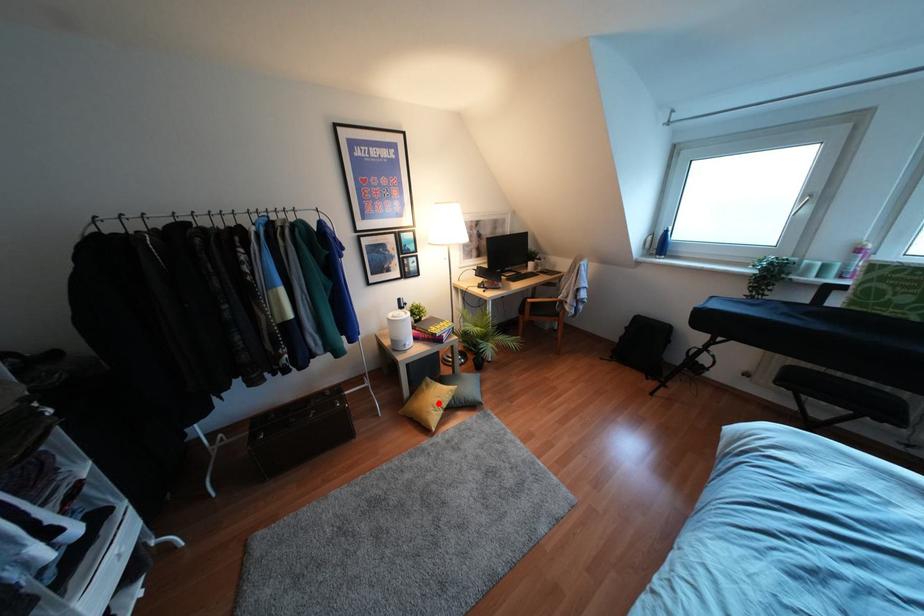
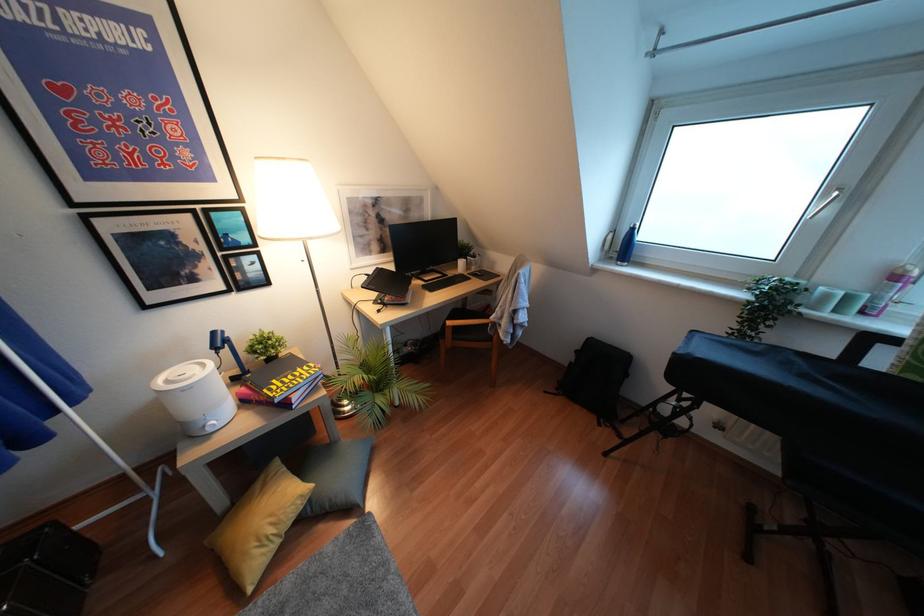
Question: I am providing you with two images of the same scene from different viewpoints. A red point is marked on the first image. Can you still see the location of the red point in image 2?

Choices:
 (A) Yes
 (B) No

Answer: (A)